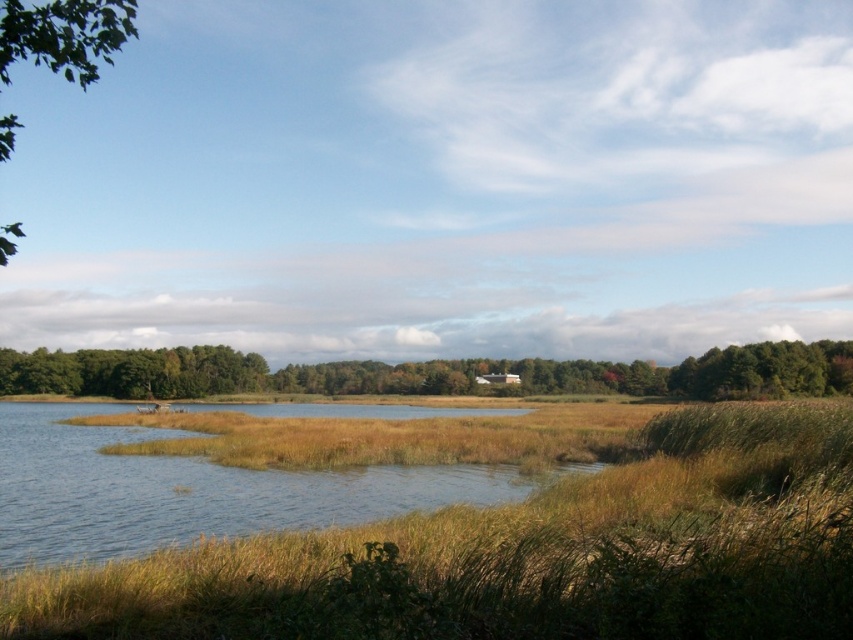
Question: Does brown grass at center have a lesser width compared to green leafy trees at center?

Choices:
 (A) no
 (B) yes

Answer: (B)

Question: Can you confirm if green leafy trees at center is bigger than green leafy tree at upper left?

Choices:
 (A) no
 (B) yes

Answer: (A)

Question: Among these points, which one is farthest from the camera?

Choices:
 (A) (86, 26)
 (B) (219, 392)

Answer: (B)

Question: Is green leafy trees at center positioned before green leafy tree at upper left?

Choices:
 (A) yes
 (B) no

Answer: (B)

Question: Which point is closer to the camera?

Choices:
 (A) (57, 24)
 (B) (778, 374)
 (C) (740, 620)

Answer: (C)

Question: Which of these objects is positioned closest to the brown grass at center?

Choices:
 (A) green leafy trees at center
 (B) green leafy tree at upper left

Answer: (B)